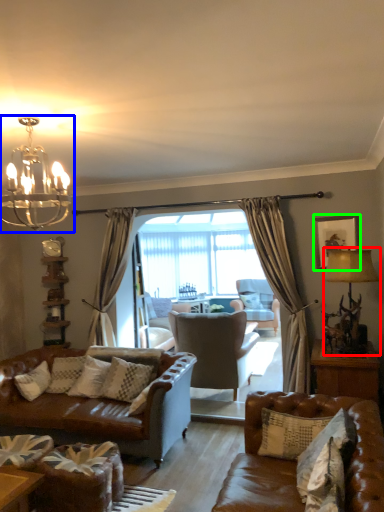
Question: Which is farther away from lamp (highlighted by a red box)? light fixture (highlighted by a blue box) or picture frame (highlighted by a green box)?

Choices:
 (A) light fixture
 (B) picture frame

Answer: (A)